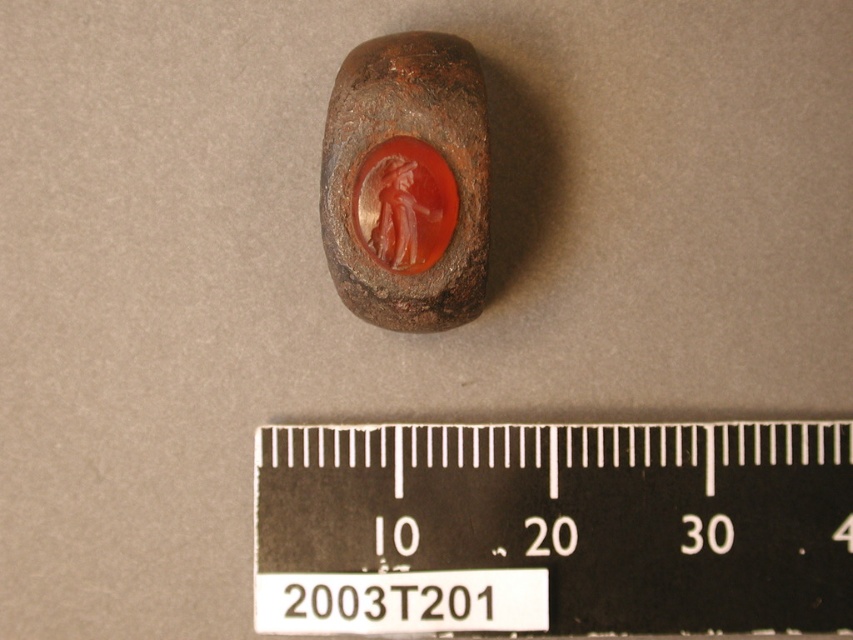
You are an archaeologist examining the artifact. You need to determine which part of the object is wider between the matte brown stone at center and the translucent orange gemstone at center. Which one is wider?

The matte brown stone at center is wider than the translucent orange gemstone at center according to the description.

You are an archaeologist examining the image of the carved gemstone. The point at coordinates (407, 182) is labeled as matte brown stone at center. Can you determine the material composition of the object based on this point?

The point at coordinates (407, 182) marks matte brown stone at center, indicating that the material at that location is matte brown stone. This suggests that the central area of the object is composed of matte brown stone, which may be part of the base material or a specific design element in the carving.